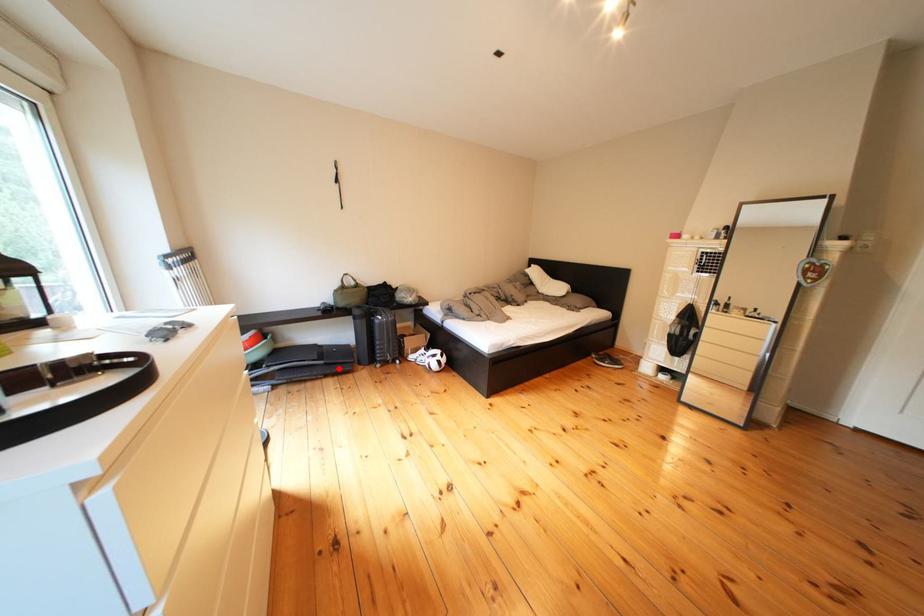
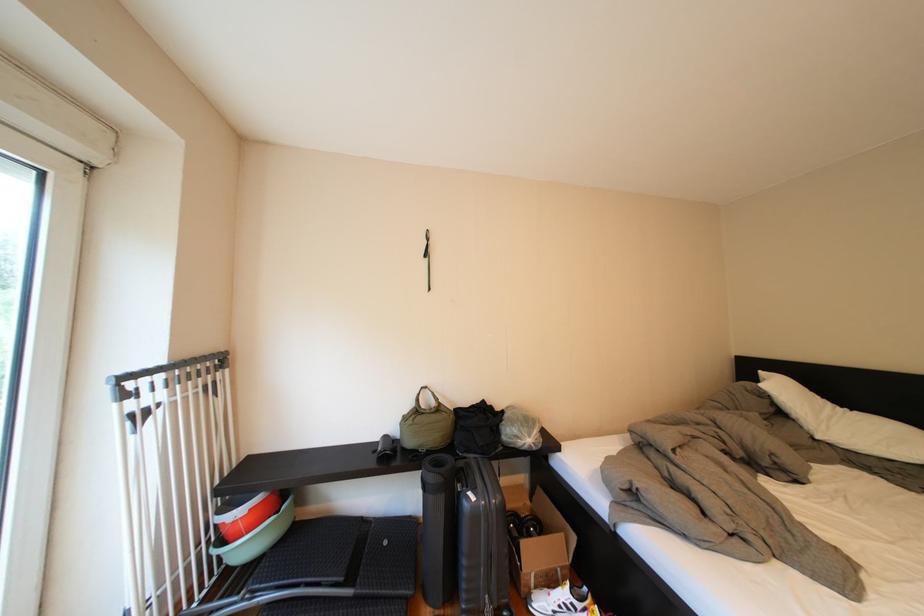
Find the pixel in the second image that matches the highlighted location in the first image.

(370, 602)